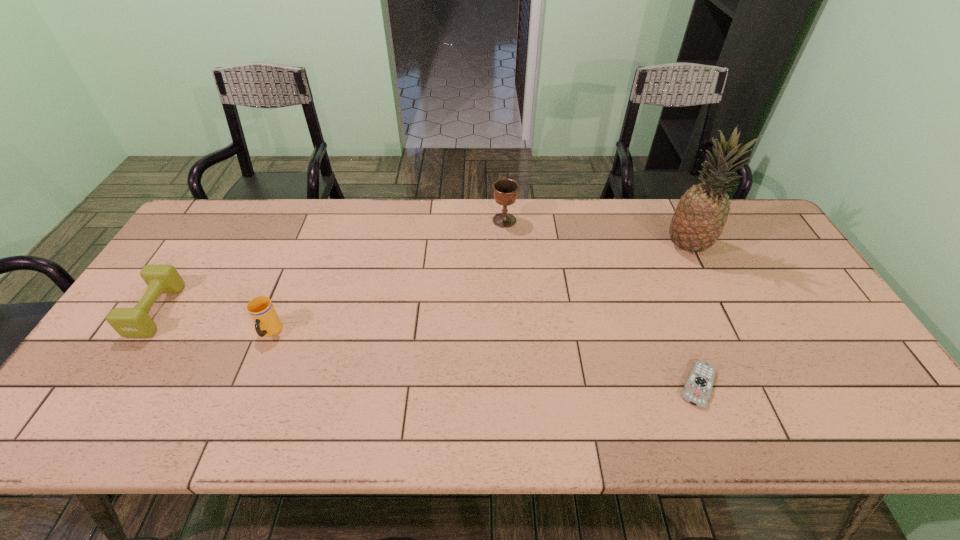
Image resolution: width=960 pixels, height=540 pixels. What are the coordinates of `free location located on the front of the fourth shortest object` in the screenshot? It's located at (507, 256).

At what (x,y) coordinates should I click in order to perform the action: click on free spot located on the side of the second object from left to right with the handle. Please return your answer as a coordinate pair (x, y). The image size is (960, 540). Looking at the image, I should click on (247, 387).

I want to click on vacant position located on the right of the dumbbell, so click(297, 310).

At what (x,y) coordinates should I click in order to perform the action: click on free location located 0.320m on the left of the remote control. Please return your answer as a coordinate pair (x, y). Looking at the image, I should click on (540, 385).

Locate an element on the screen. The width and height of the screenshot is (960, 540). pineapple that is at the far edge is located at coordinates (701, 214).

Where is `chalice at the far edge`? This screenshot has width=960, height=540. chalice at the far edge is located at coordinates (505, 191).

At what (x,y) coordinates should I click in order to perform the action: click on object that is at the near edge. Please return your answer as a coordinate pair (x, y). This screenshot has height=540, width=960. Looking at the image, I should click on (698, 387).

You are a GUI agent. You are given a task and a screenshot of the screen. Output one action in this format:
    pyautogui.click(x=<x>, y=<y>)
    Task: Click on the object situated at the left edge
    
    Given the screenshot: What is the action you would take?
    pyautogui.click(x=135, y=322)

In the image, there is a desktop. Where is `vacant space at the far edge`? vacant space at the far edge is located at coordinates [322, 233].

Locate an element on the screen. vacant region at the near edge of the desktop is located at coordinates (655, 420).